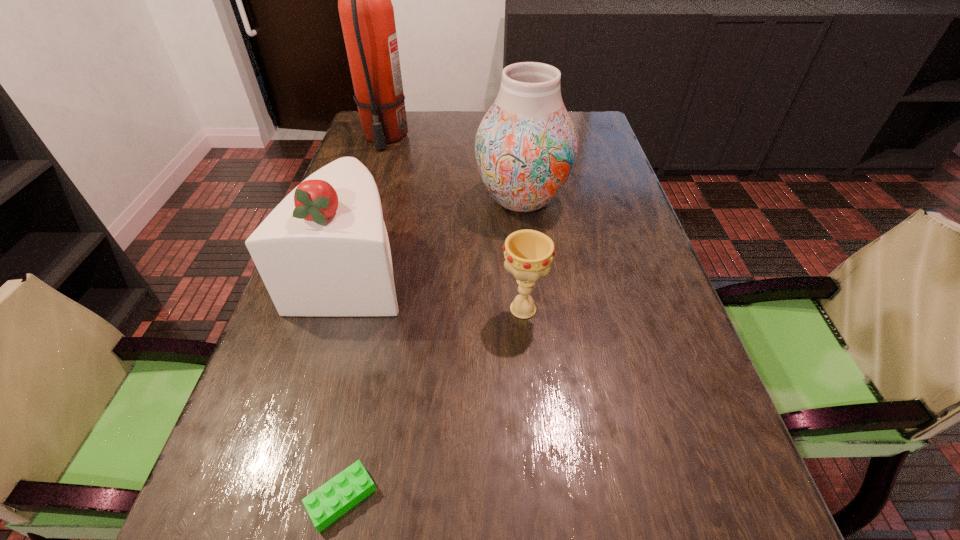
Identify the location of vacant space in between the Lego and the second shortest object. Image resolution: width=960 pixels, height=540 pixels. (432, 403).

Locate an element on the screen. vacant region between the tallest object and the second shortest object is located at coordinates (454, 223).

The height and width of the screenshot is (540, 960). Identify the location of empty space between the nearest object and the tallest object. (363, 318).

Identify the location of free spot between the farthest object and the vase. (453, 168).

You are a GUI agent. You are given a task and a screenshot of the screen. Output one action in this format:
    pyautogui.click(x=<x>, y=<y>)
    Task: Click on the free area in between the tallest object and the vase
    
    Given the screenshot: What is the action you would take?
    pyautogui.click(x=453, y=168)

Find the location of a particular element. unoccupied position between the third shortest object and the shortest object is located at coordinates (348, 383).

The image size is (960, 540). In order to click on free point between the vase and the tallest object in this screenshot , I will do `click(453, 168)`.

Where is `unoccupied position between the vase and the nearest object`? This screenshot has width=960, height=540. unoccupied position between the vase and the nearest object is located at coordinates (432, 349).

You are a GUI agent. You are given a task and a screenshot of the screen. Output one action in this format:
    pyautogui.click(x=<x>, y=<y>)
    Task: Click on the vacant space in between the Lego and the vase
    The image size is (960, 540).
    Given the screenshot: What is the action you would take?
    pyautogui.click(x=432, y=349)

Point out which object is positioned as the second nearest to the cake. Please provide its 2D coordinates. Your answer should be formatted as a tuple, i.e. [(x, y)], where the tuple contains the x and y coordinates of a point satisfying the conditions above.

[(528, 254)]